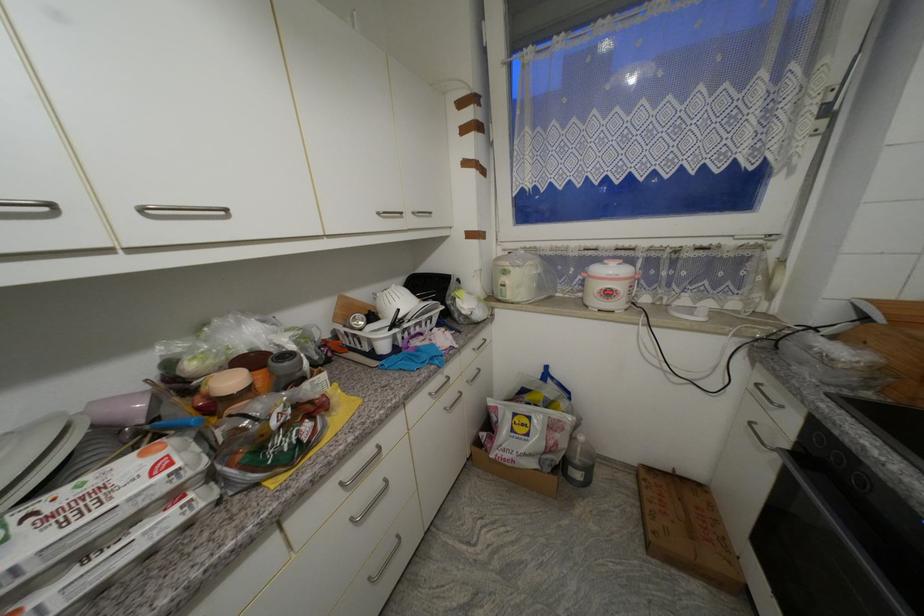
Find where to lift the pink mug. Please return your answer as a coordinate pair (x, y).

(123, 408)